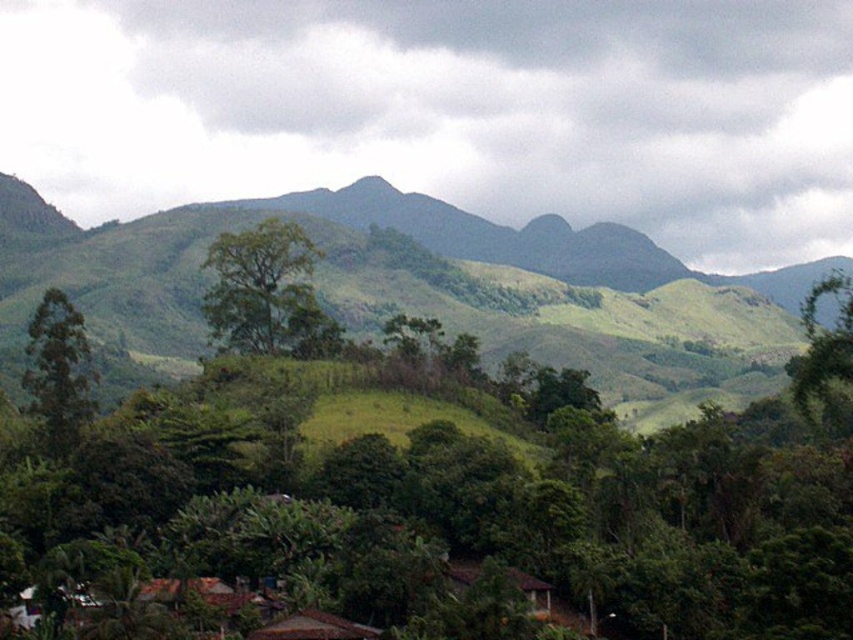
Looking at this image, is green grassy hill at center wider than green leafy tree at right?

Indeed, green grassy hill at center has a greater width compared to green leafy tree at right.

Where is `green grassy hill at center`? Image resolution: width=853 pixels, height=640 pixels. green grassy hill at center is located at coordinates (434, 288).

You are a GUI agent. You are given a task and a screenshot of the screen. Output one action in this format:
    pyautogui.click(x=<x>, y=<y>)
    Task: Click on the green grassy hill at center
    Image resolution: width=853 pixels, height=640 pixels.
    Given the screenshot: What is the action you would take?
    pyautogui.click(x=434, y=288)

Who is positioned more to the left, green leafy tree at left or green leafy tree at right?

green leafy tree at left

The image size is (853, 640). What are the coordinates of `green leafy tree at left` in the screenshot? It's located at (59, 371).

Does point (77, 392) come in front of point (846, 323)?

No, (77, 392) is behind (846, 323).

This screenshot has height=640, width=853. I want to click on green leafy tree at left, so click(x=59, y=371).

Does green grassy hill at center appear on the right side of green leafy tree at center?

Yes, green grassy hill at center is to the right of green leafy tree at center.

Who is positioned more to the left, green grassy hill at center or green leafy tree at center?

green leafy tree at center is more to the left.

Measure the distance between green grassy hill at center and camera.

green grassy hill at center is 624.73 feet away from camera.

Where is `green grassy hill at center`? The width and height of the screenshot is (853, 640). green grassy hill at center is located at coordinates (434, 288).